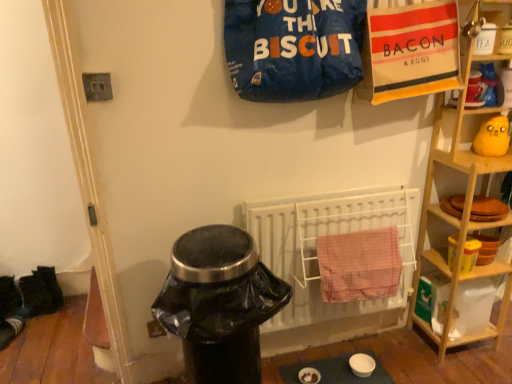
Question: Can you confirm if black fabric shoes at lower left, marked as the second footwear in a front-to-back arrangement, is taller than wooden shelf at right?

Choices:
 (A) no
 (B) yes

Answer: (A)

Question: From a real-world perspective, is black fabric shoes at lower left, marked as the second footwear in a front-to-back arrangement, positioned over wooden shelf at right based on gravity?

Choices:
 (A) no
 (B) yes

Answer: (A)

Question: Does black fabric shoes at lower left, placed as the second footwear when sorted from bottom to top, come in front of wooden shelf at right?

Choices:
 (A) no
 (B) yes

Answer: (A)

Question: Is black fabric shoes at lower left, placed as the first footwear when sorted from back to front, smaller than wooden shelf at right?

Choices:
 (A) yes
 (B) no

Answer: (A)

Question: Would you say black fabric shoes at lower left, marked as the second footwear in a front-to-back arrangement, is outside wooden shelf at right?

Choices:
 (A) no
 (B) yes

Answer: (B)

Question: Considering the positions of pink checkered towel at center and matte blue table at lower center in the image, is pink checkered towel at center wider or thinner than matte blue table at lower center?

Choices:
 (A) wide
 (B) thin

Answer: (B)

Question: Considering the positions of point (344, 241) and point (328, 374), is point (344, 241) closer or farther from the camera than point (328, 374)?

Choices:
 (A) closer
 (B) farther

Answer: (A)

Question: From the image's perspective, is pink checkered towel at center located above or below matte blue table at lower center?

Choices:
 (A) above
 (B) below

Answer: (A)

Question: Is pink checkered towel at center bigger or smaller than matte blue table at lower center?

Choices:
 (A) big
 (B) small

Answer: (A)

Question: Is black fabric shoes at lower left, marked as the second footwear in a front-to-back arrangement, in front of or behind black plastic trash can at lower center in the image?

Choices:
 (A) behind
 (B) front

Answer: (A)

Question: From the image's perspective, relative to black plastic trash can at lower center, is black fabric shoes at lower left, placed as the second footwear when sorted from bottom to top, above or below?

Choices:
 (A) below
 (B) above

Answer: (B)

Question: Considering the positions of black fabric shoes at lower left, marked as the second footwear in a front-to-back arrangement, and black plastic trash can at lower center in the image, is black fabric shoes at lower left, marked as the second footwear in a front-to-back arrangement, taller or shorter than black plastic trash can at lower center?

Choices:
 (A) short
 (B) tall

Answer: (A)

Question: From a real-world perspective, is black fabric shoes at lower left, placed as the first footwear when sorted from back to front, above or below black plastic trash can at lower center?

Choices:
 (A) above
 (B) below

Answer: (B)

Question: From the image's perspective, is blue fabric sack at upper center located above or below wooden shelf at right?

Choices:
 (A) above
 (B) below

Answer: (A)

Question: In terms of height, does blue fabric sack at upper center look taller or shorter compared to wooden shelf at right?

Choices:
 (A) short
 (B) tall

Answer: (A)